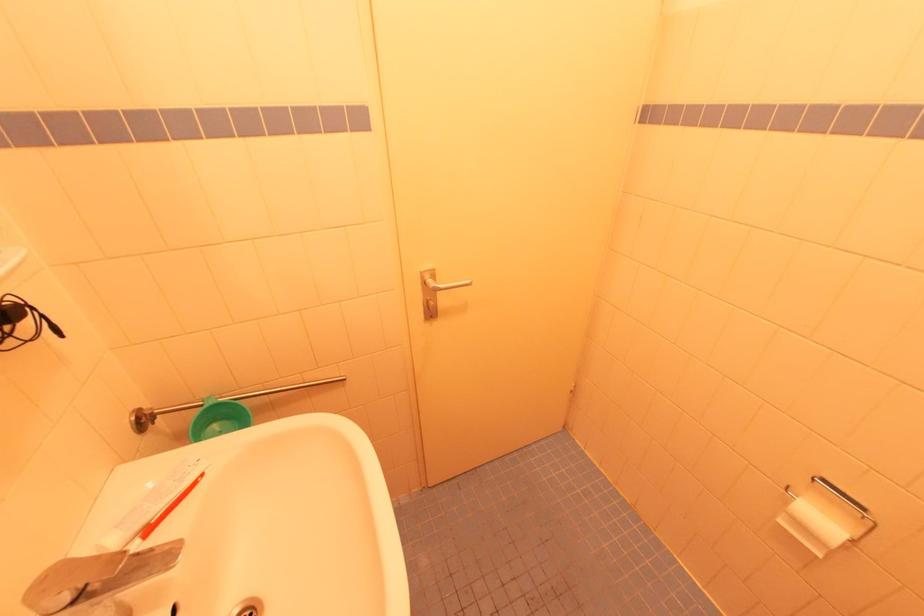
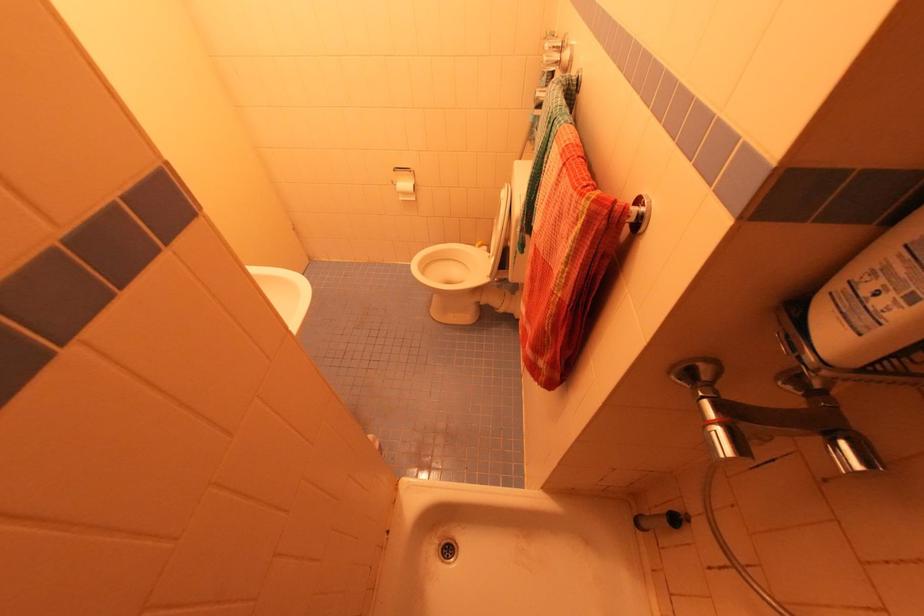
First-person continuous shooting, in which direction is the camera rotating?

The rotation direction of the camera is right-down.